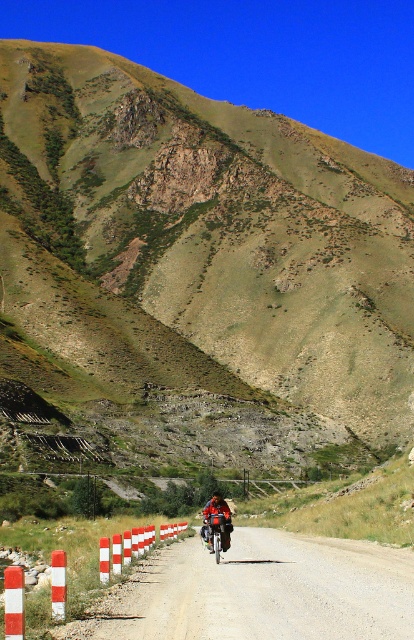
You are a hiker standing at the starting point of the dirt road. You see two points marked on the road ahead. The first point is at coordinate point (247, 458) and the second point is at coordinate point (108, 609). Which point is closer to you as you begin your hike?

Point (108, 609) is closer to you because it is less further to the camera than point (247, 458).

You are a hiker planning to cross the smooth asphalt road at center. There is a red and white striped barrier at lower left nearby. Which object is higher in elevation?

The smooth asphalt road at center is higher in elevation than the red and white striped barrier at lower left because it is positioned above it.

You are driving a car with a turning radius of 12 meters. You need to navigate around the red and white striped barrier at lower left and the smooth asphalt road at center. Which object allows for a tighter turn? Please explain your reasoning based on their positions.

The smooth asphalt road at center is closer to the viewer than the red and white striped barrier at lower left. Since the road is closer, it likely has a tighter turn radius compared to the barrier, allowing the car to navigate around it more easily within its 12 meters turning radius.